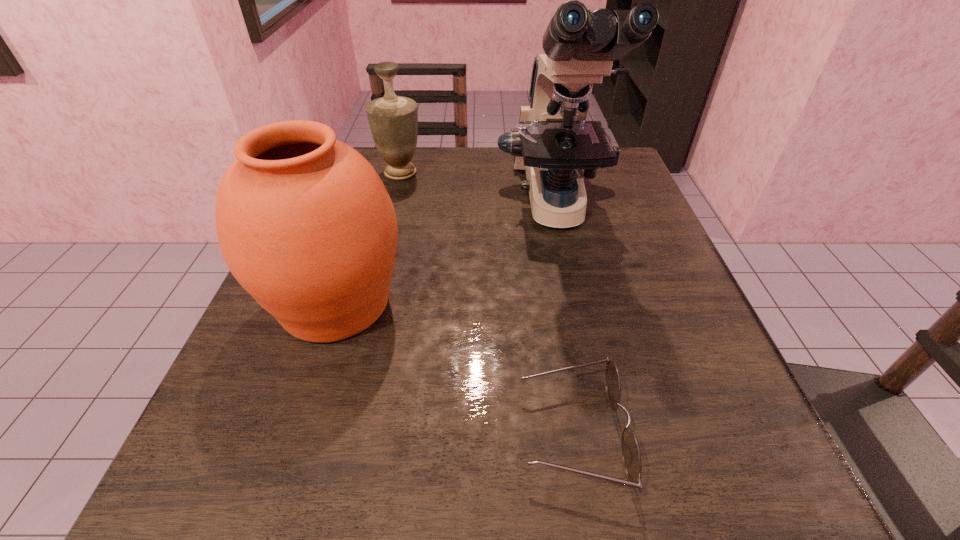
This screenshot has height=540, width=960. In order to click on microscope in this screenshot , I will do `click(553, 141)`.

Find the location of a particular element. the taller urn is located at coordinates (305, 224).

Identify the location of the nearer urn. The width and height of the screenshot is (960, 540). (305, 224).

The image size is (960, 540). In order to click on the second shortest object in this screenshot , I will do `click(393, 120)`.

Image resolution: width=960 pixels, height=540 pixels. In order to click on the shorter urn in this screenshot , I will do `click(393, 120)`.

At what (x,y) coordinates should I click in order to perform the action: click on the shortest object. Please return your answer as a coordinate pair (x, y). Looking at the image, I should click on (631, 457).

I want to click on spectacles, so point(631,457).

I want to click on free space located through the eyepieces of the microscope, so tap(583, 334).

You are a GUI agent. You are given a task and a screenshot of the screen. Output one action in this format:
    pyautogui.click(x=<x>, y=<y>)
    Task: Click on the vacant space located 0.220m on the back of the nearer urn
    This screenshot has width=960, height=540.
    Given the screenshot: What is the action you would take?
    pyautogui.click(x=372, y=193)

The image size is (960, 540). What are the coordinates of `vacant space situated 0.070m on the left of the farther urn` in the screenshot? It's located at (348, 173).